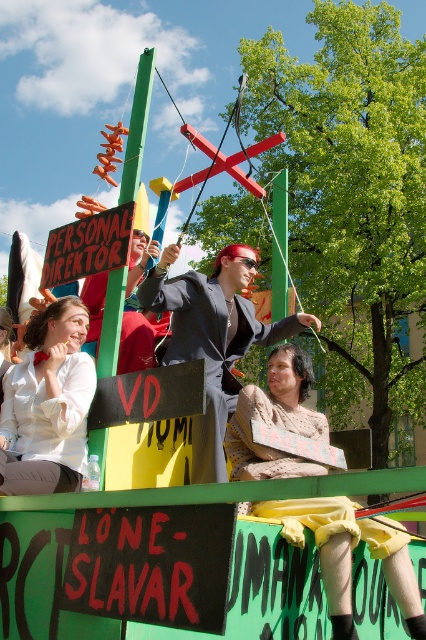
Is white matte shirt at upper left bigger than shiny black suit at center?

Actually, white matte shirt at upper left might be smaller than shiny black suit at center.

What do you see at coordinates (48, 404) in the screenshot?
I see `white matte shirt at upper left` at bounding box center [48, 404].

Image resolution: width=426 pixels, height=640 pixels. Describe the element at coordinates (48, 404) in the screenshot. I see `white matte shirt at upper left` at that location.

The width and height of the screenshot is (426, 640). I want to click on white matte shirt at upper left, so click(x=48, y=404).